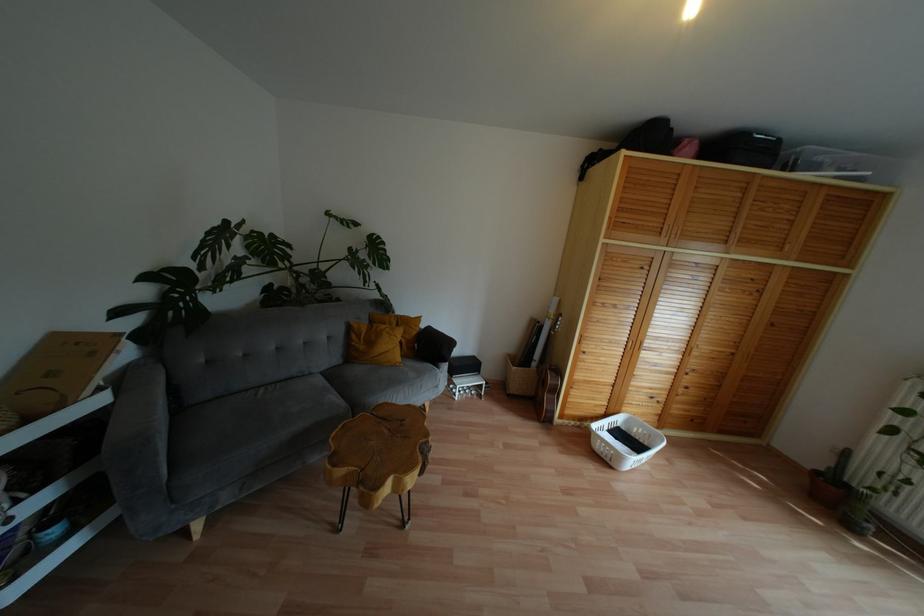
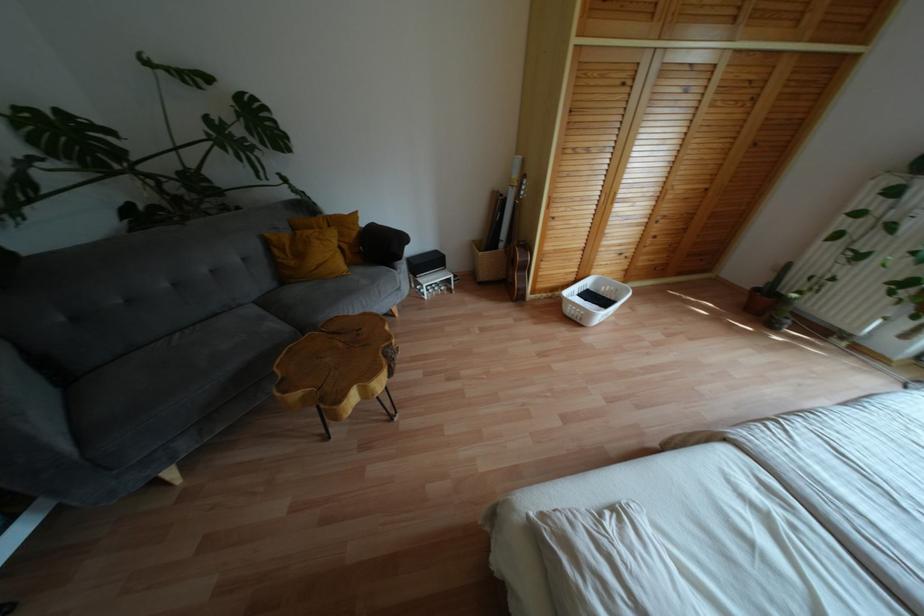
Find the pixel in the second image that matches (378,237) in the first image.

(253, 98)